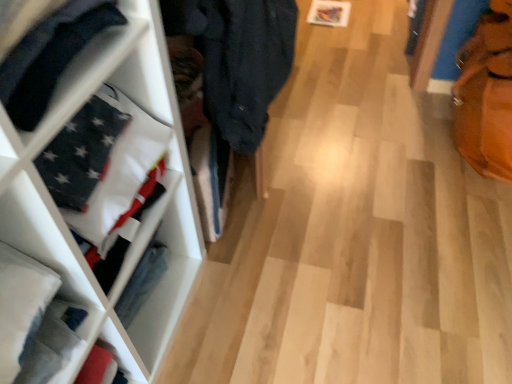
Locate an element on the screen. This screenshot has width=512, height=384. vacant region below white fabric at left (from a real-world perspective) is located at coordinates (169, 306).